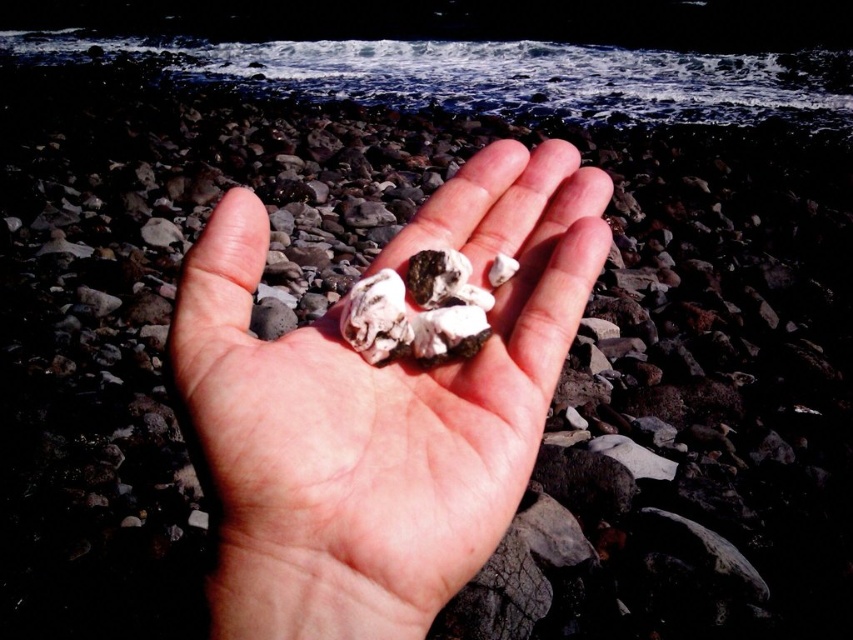
Between white matte rocks at center and white matte oyster at center, which one has more height?

With more height is white matte rocks at center.

Where is `white matte rocks at center`? This screenshot has width=853, height=640. white matte rocks at center is located at coordinates (379, 408).

Image resolution: width=853 pixels, height=640 pixels. Find the location of `white matte rocks at center`. white matte rocks at center is located at coordinates (379, 408).